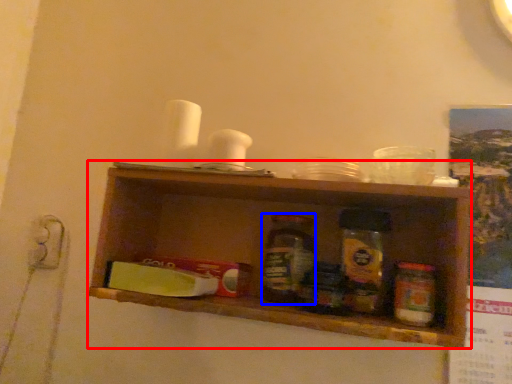
Question: Which of the following is the closest to the observer, shelf (highlighted by a red box) or bottle (highlighted by a blue box)?

Choices:
 (A) shelf
 (B) bottle

Answer: (A)